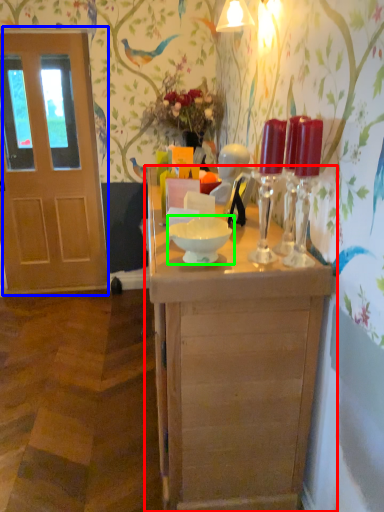
Question: Considering the real-world distances, which object is farthest from table (highlighted by a red box)? door (highlighted by a blue box) or bowl (highlighted by a green box)?

Choices:
 (A) door
 (B) bowl

Answer: (A)